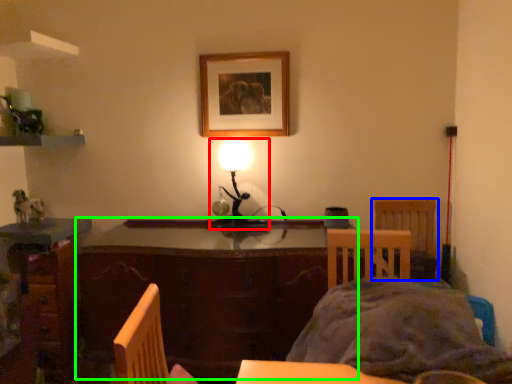
Question: Which object is the farthest from lamp (highlighted by a red box)? Choose among these: chair (highlighted by a blue box) or table (highlighted by a green box).

Choices:
 (A) chair
 (B) table

Answer: (A)